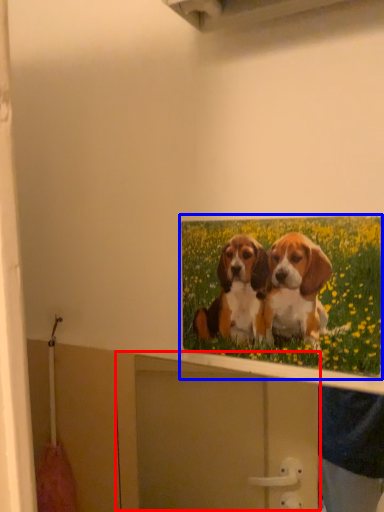
Question: Which point is closer to the camera, cabinet (highlighted by a red box) or picture frame (highlighted by a blue box)?

Choices:
 (A) cabinet
 (B) picture frame

Answer: (A)